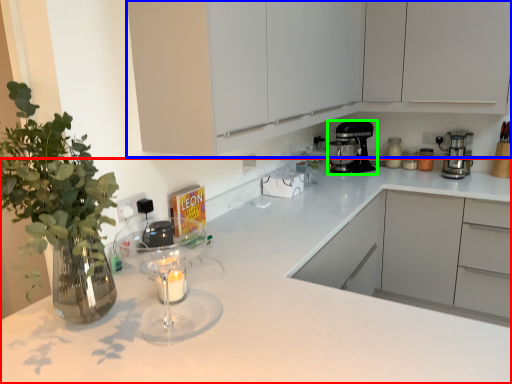
Question: Which object is positioned farthest from countertop (highlighted by a red box)? Select from cabinetry (highlighted by a blue box) and kitchen appliance (highlighted by a green box).

Choices:
 (A) cabinetry
 (B) kitchen appliance

Answer: (B)